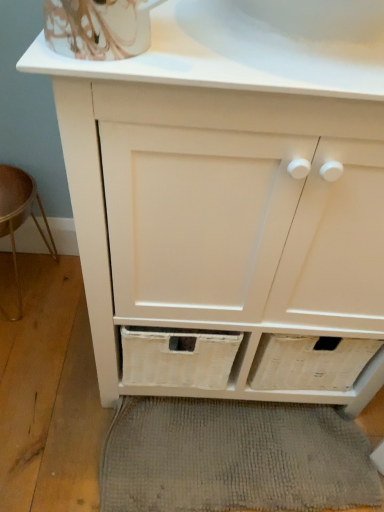
Question: Would you say white porcelain sink at upper center is to the left or to the right of gray woven bath mat at lower center in the picture?

Choices:
 (A) left
 (B) right

Answer: (B)

Question: In terms of height, does white porcelain sink at upper center look taller or shorter compared to gray woven bath mat at lower center?

Choices:
 (A) short
 (B) tall

Answer: (A)

Question: Estimate the real-world distances between objects in this image. Which object is closer to the white porcelain sink at upper center?

Choices:
 (A) wooden stool at lower left
 (B) gray woven bath mat at lower center

Answer: (A)

Question: Which object is the closest to the white porcelain sink at upper center?

Choices:
 (A) gray woven bath mat at lower center
 (B) wooden stool at lower left

Answer: (B)